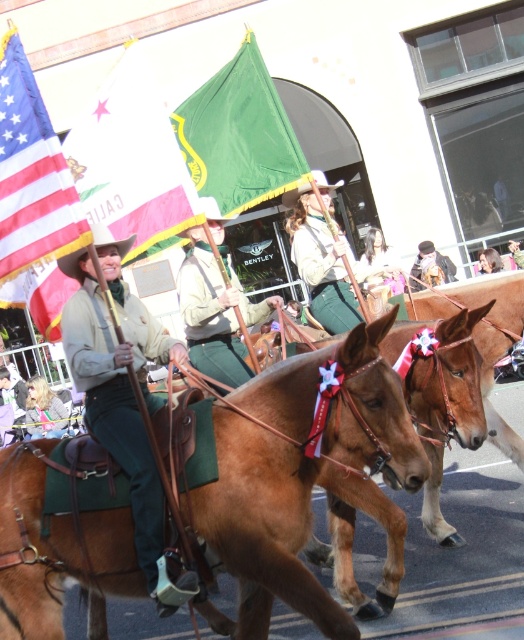
Question: Does green fabric flag at center appear on the left side of green fabric hat at upper center?

Choices:
 (A) yes
 (B) no

Answer: (A)

Question: Where is smooth brown leather hat at upper center located in relation to smooth brown hair at upper center in the image?

Choices:
 (A) above
 (B) below

Answer: (B)

Question: Which point appears farthest from the camera in this image?

Choices:
 (A) (84, 204)
 (B) (369, 278)

Answer: (B)

Question: Can you confirm if smooth brown leather hat at upper center is positioned below smooth brown hair at upper center?

Choices:
 (A) yes
 (B) no

Answer: (A)

Question: Which of the following is the closest to the observer?

Choices:
 (A) tap(376, 278)
 (B) tap(500, 264)
 (C) tap(45, 426)
 (D) tap(85, 108)

Answer: (A)

Question: Which object is the farthest from the leather jacket at center?

Choices:
 (A) smooth brown leather hat at upper center
 (B) brown leather saddle at center
 (C) green fabric hat at upper center
 (D) green canvas hat at center

Answer: (C)